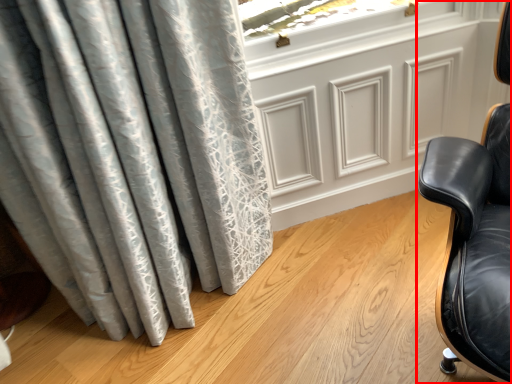
Question: In this image, where is chair (annotated by the red box) located relative to screen door?

Choices:
 (A) right
 (B) left

Answer: (A)